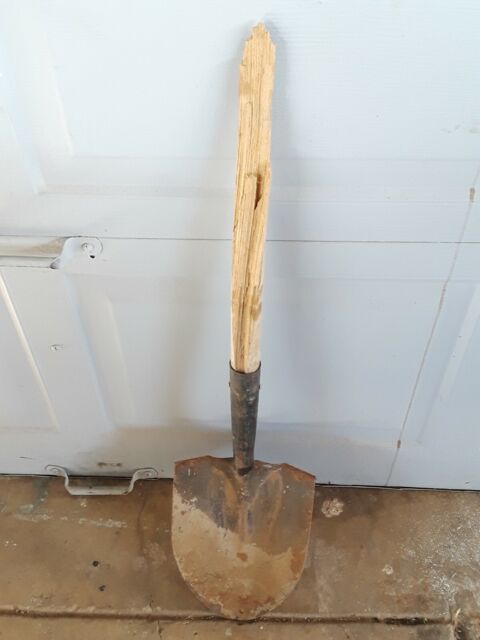
This screenshot has width=480, height=640. Identify the location of white cupboard. (321, 120), (320, 372).